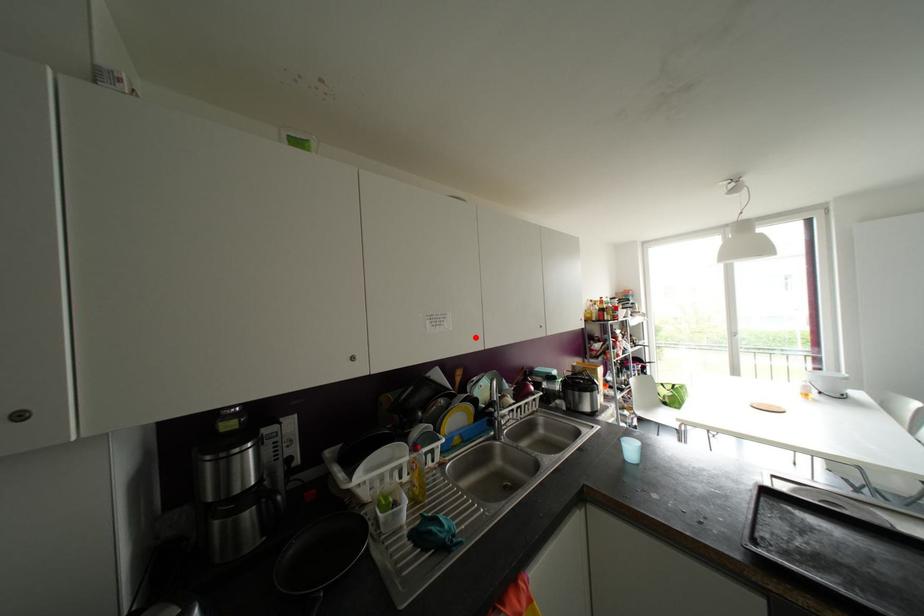
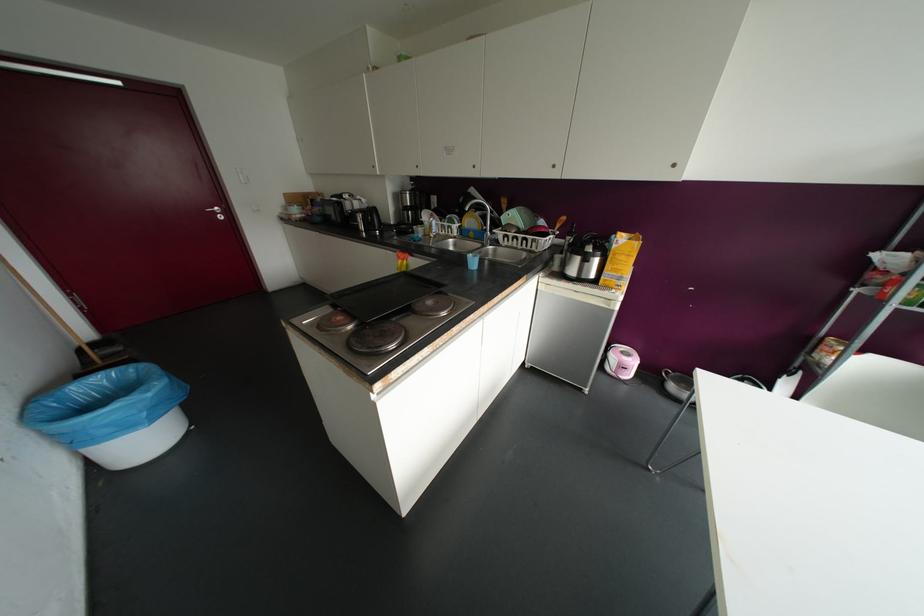
Where in the second image is the point corresponding to the highlighted location from the first image?

(473, 166)